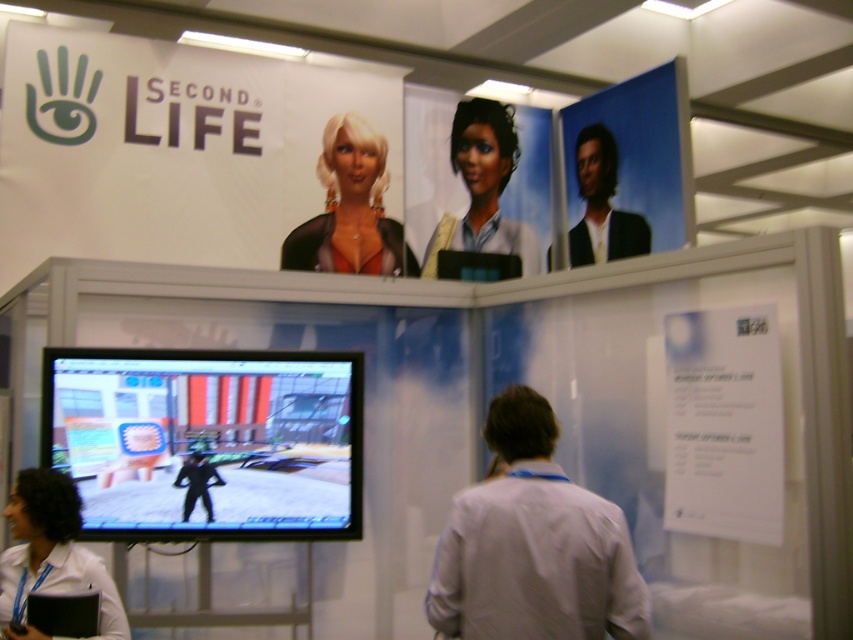
Question: From the image, what is the correct spatial relationship of matte black banner at upper center in relation to white paper at upper center?

Choices:
 (A) left
 (B) right

Answer: (A)

Question: Which of the following is the closest to the observer?

Choices:
 (A) (103, 225)
 (B) (392, 253)
 (C) (143, 436)
 (D) (608, 154)

Answer: (C)

Question: Is black glossy suit at center positioned before shiny black hair at upper right?

Choices:
 (A) yes
 (B) no

Answer: (A)

Question: Can you confirm if black glossy suit at center is bigger than shiny black hair at upper right?

Choices:
 (A) yes
 (B) no

Answer: (A)

Question: Which point is farther from the camera taking this photo?

Choices:
 (A) (421, 272)
 (B) (554, 620)
 (C) (294, 260)
 (D) (306, 218)

Answer: (A)

Question: Which is nearer to the matte black banner at upper center?

Choices:
 (A) white shirt at lower left
 (B) satin black doll at center
 (C) white cotton shirt at center

Answer: (B)